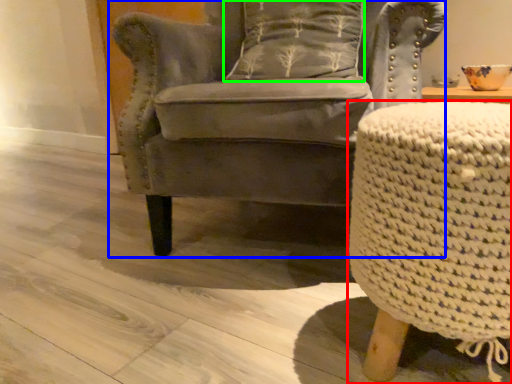
Question: Which object is positioned closest to table (highlighted by a red box)? Select from chair (highlighted by a blue box) and pillow (highlighted by a green box).

Choices:
 (A) chair
 (B) pillow

Answer: (A)